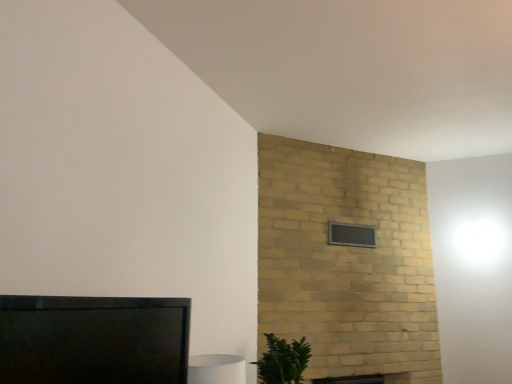
Question: Considering the relative sizes of black glass window at upper center and matte black tv at lower left in the image provided, is black glass window at upper center thinner than matte black tv at lower left?

Choices:
 (A) yes
 (B) no

Answer: (A)

Question: Is black glass window at upper center positioned with its back to matte black tv at lower left?

Choices:
 (A) no
 (B) yes

Answer: (A)

Question: Is black glass window at upper center positioned beyond the bounds of matte black tv at lower left?

Choices:
 (A) no
 (B) yes

Answer: (B)

Question: Is black glass window at upper center further to the viewer compared to matte black tv at lower left?

Choices:
 (A) no
 (B) yes

Answer: (B)

Question: Can you confirm if black glass window at upper center is bigger than matte black tv at lower left?

Choices:
 (A) no
 (B) yes

Answer: (A)

Question: Do you think black glass window at upper center is within green leafy plant at lower right, or outside of it?

Choices:
 (A) outside
 (B) inside

Answer: (A)

Question: From a real-world perspective, relative to green leafy plant at lower right, is black glass window at upper center vertically above or below?

Choices:
 (A) above
 (B) below

Answer: (A)

Question: From the image's perspective, is black glass window at upper center positioned above or below green leafy plant at lower right?

Choices:
 (A) above
 (B) below

Answer: (A)

Question: Based on their sizes in the image, would you say black glass window at upper center is bigger or smaller than green leafy plant at lower right?

Choices:
 (A) big
 (B) small

Answer: (B)

Question: Is point (263, 360) positioned closer to the camera than point (346, 231)?

Choices:
 (A) closer
 (B) farther

Answer: (A)

Question: Based on their positions, is green leafy plant at lower right located to the left or right of black glass window at upper center?

Choices:
 (A) right
 (B) left

Answer: (B)

Question: Is green leafy plant at lower right bigger or smaller than black glass window at upper center?

Choices:
 (A) big
 (B) small

Answer: (A)

Question: In terms of height, does green leafy plant at lower right look taller or shorter compared to black glass window at upper center?

Choices:
 (A) short
 (B) tall

Answer: (B)

Question: Is black glass window at upper center situated inside matte black tv at lower left or outside?

Choices:
 (A) inside
 (B) outside

Answer: (B)

Question: Is point (365, 233) closer or farther from the camera than point (88, 311)?

Choices:
 (A) farther
 (B) closer

Answer: (A)